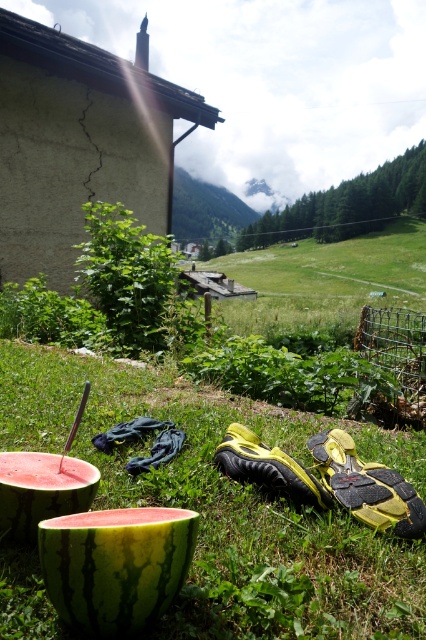
Is point (334, 563) positioned before point (143, 525)?

No, it is not.

Who is lower down, green grass at center or green rind watermelon at lower center?

green grass at center is lower down.

Who is more forward, (178, 467) or (155, 515)?

Point (155, 515)

Image resolution: width=426 pixels, height=640 pixels. I want to click on green grass at center, so click(221, 508).

Does point (198, 392) lie behind point (88, 502)?

Yes, it is.

Identify the location of green grass at center. (221, 508).

Which is in front, point (71, 541) or point (23, 460)?

Point (71, 541) is more forward.

Is green rind watermelon at lower center positioned behind ripe red watermelon at lower left?

No.

Is point (115, 586) positioned in front of point (16, 467)?

Yes.

Locate an element on the screen. The height and width of the screenshot is (640, 426). green rind watermelon at lower center is located at coordinates (115, 564).